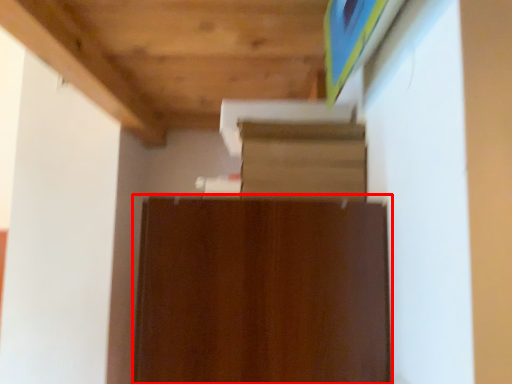
Question: Observing the image, what is the correct spatial positioning of cabinetry (annotated by the red box) in reference to shelf?

Choices:
 (A) left
 (B) right

Answer: (A)